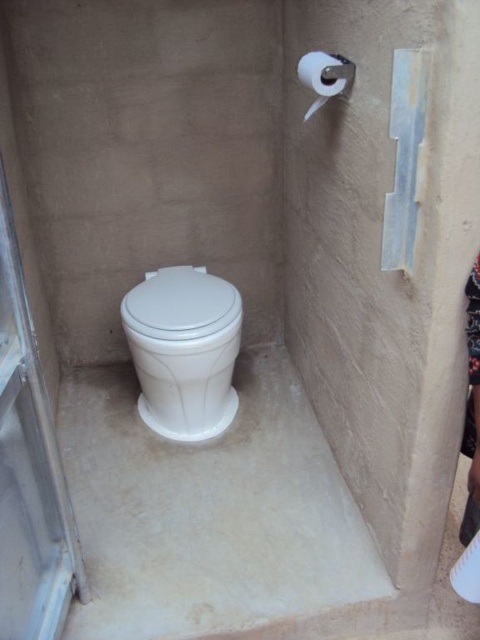
You are standing in the bathroom stall and want to exit through the door. The clear plastic screen door at left is partially open. To exit, you need to move towards the point at coordinates (29, 472). Is this point located on the clear plastic screen door at left?

Yes, the point at coordinates (29, 472) is on the clear plastic screen door at left, so moving towards this point will lead you toward the door.